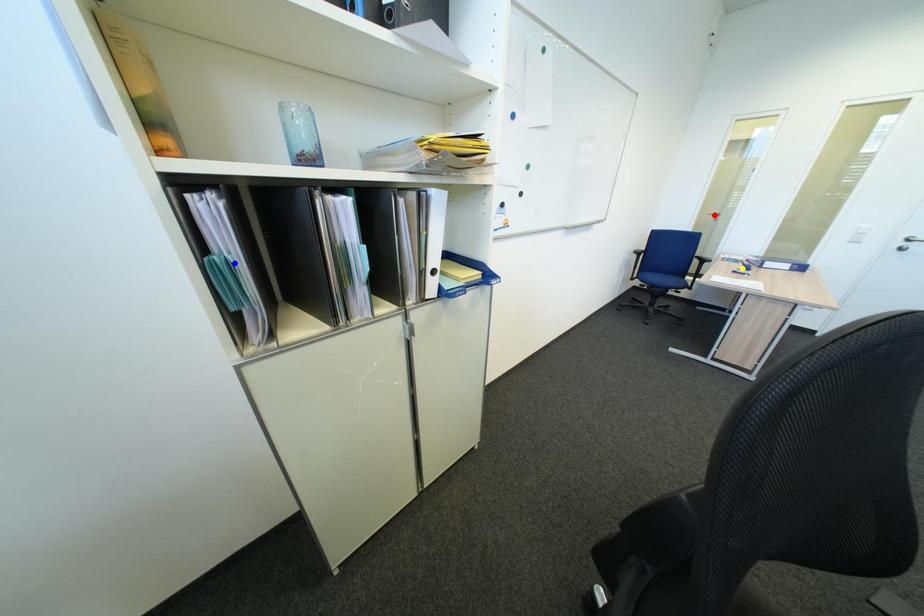
From the picture: Order these from nearest to farthest:
yellow point
blue point
red point

blue point < yellow point < red point